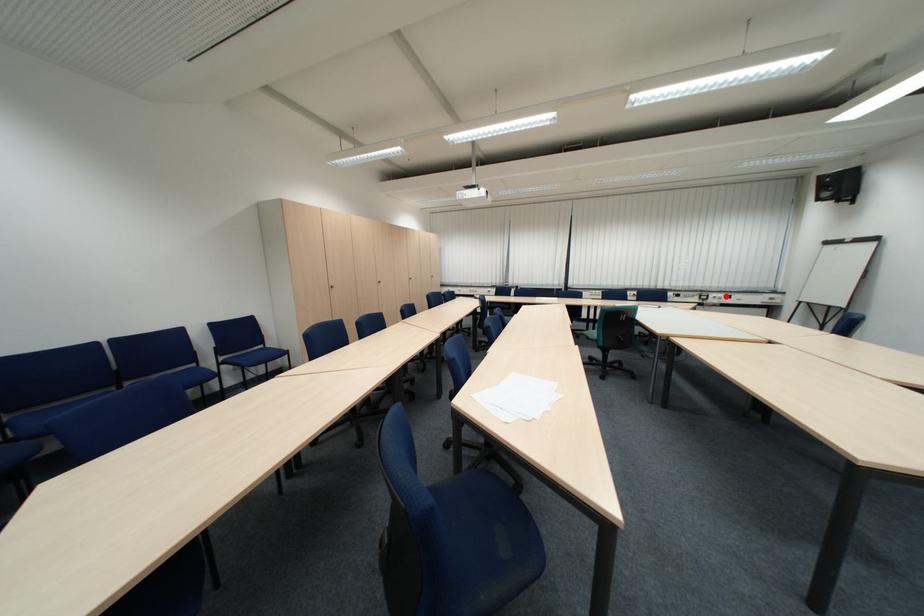
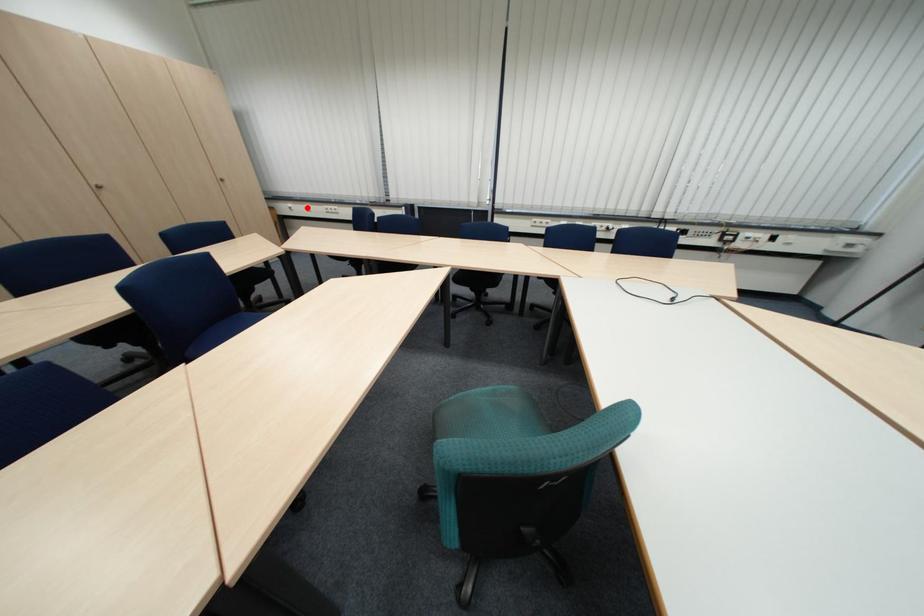
I am providing you with two images of the same scene from different viewpoints. A red point is marked on the first image and another point is marked on the second image. Are the points marked in image1 and image2 representing the same 3D position?

No